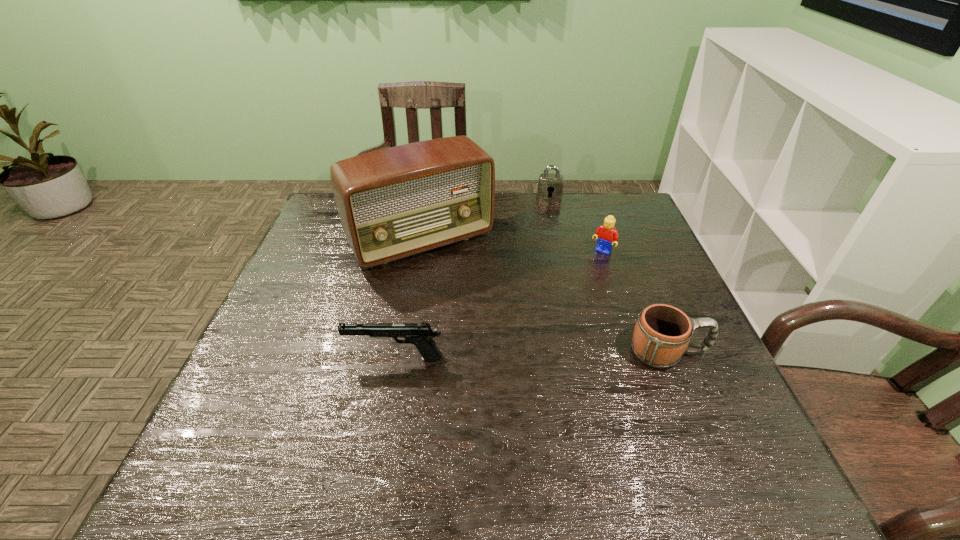
The image size is (960, 540). Find the location of `free spot that satisfies the following two spatial constraints: 1. on the front side of the farthest object; 2. on the side of the mug with the handle`. free spot that satisfies the following two spatial constraints: 1. on the front side of the farthest object; 2. on the side of the mug with the handle is located at coordinates (585, 353).